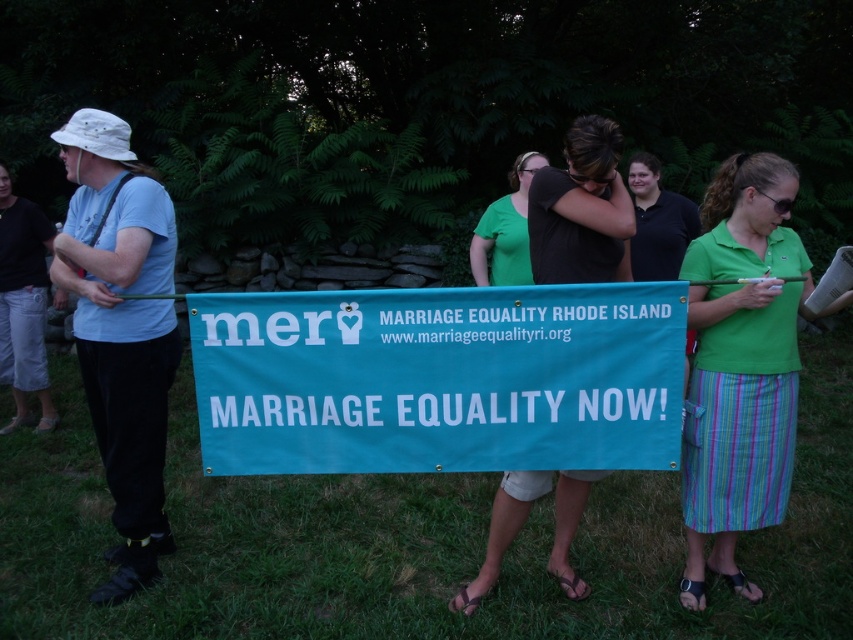
Question: Is teal fabric banner at center closer to the viewer compared to dark brown hair at center?

Choices:
 (A) yes
 (B) no

Answer: (A)

Question: Which of the following is the farthest from the observer?

Choices:
 (A) dark brown hair at center
 (B) green cotton shirt at center

Answer: (A)

Question: Among these objects, which one is nearest to the camera?

Choices:
 (A) teal fabric banner at center
 (B) green cotton shirt at center
 (C) dark brown hair at center

Answer: (A)

Question: In this image, where is teal fabric banner at center located relative to green cotton shirt at center?

Choices:
 (A) above
 (B) below

Answer: (A)

Question: Which object is closer to the camera taking this photo?

Choices:
 (A) green cotton shirt at center
 (B) teal fabric banner at center
 (C) dark brown hair at center

Answer: (B)

Question: Can you confirm if teal fabric banner at center is positioned to the left of dark brown hair at center?

Choices:
 (A) yes
 (B) no

Answer: (A)